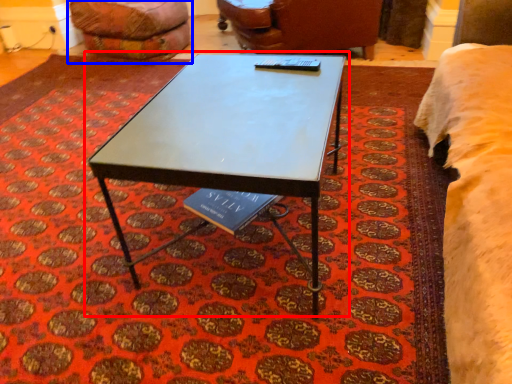
Question: Which of the following is the closest to the observer, coffee table (highlighted by a red box) or bean bag chair (highlighted by a blue box)?

Choices:
 (A) coffee table
 (B) bean bag chair

Answer: (A)